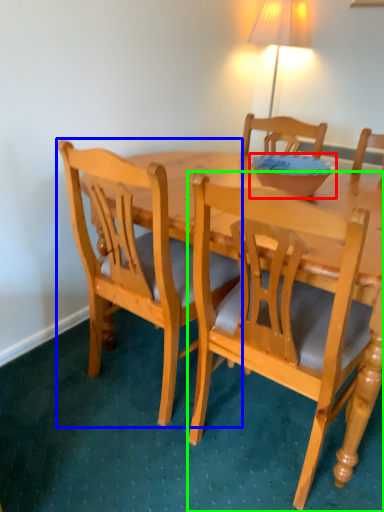
Question: Considering the real-world distances, which object is farthest from bowl (highlighted by a red box)? chair (highlighted by a blue box) or chair (highlighted by a green box)?

Choices:
 (A) chair
 (B) chair

Answer: (A)